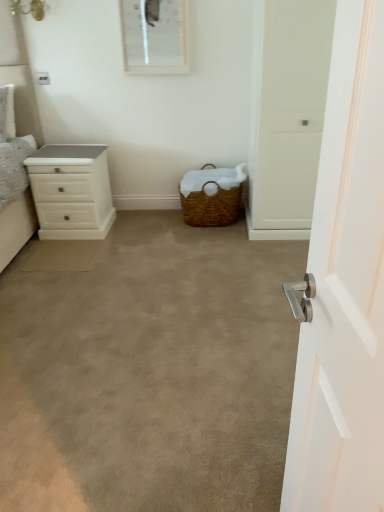
Question: Visually, is beige carpet at center positioned to the left or to the right of white matte door handle at right?

Choices:
 (A) left
 (B) right

Answer: (A)

Question: Considering the positions of beige carpet at center and white matte door handle at right in the image, is beige carpet at center taller or shorter than white matte door handle at right?

Choices:
 (A) tall
 (B) short

Answer: (B)

Question: Which of these objects is positioned farthest from the white glossy chest of drawers at left?

Choices:
 (A) white glossy picture frame at upper center
 (B) woven brown picnic basket at center
 (C) beige carpet at center
 (D) white matte door handle at right

Answer: (D)

Question: Considering the real-world distances, which object is farthest from the white glossy picture frame at upper center?

Choices:
 (A) white matte door handle at right
 (B) beige carpet at center
 (C) white glossy chest of drawers at left
 (D) woven brown picnic basket at center

Answer: (A)